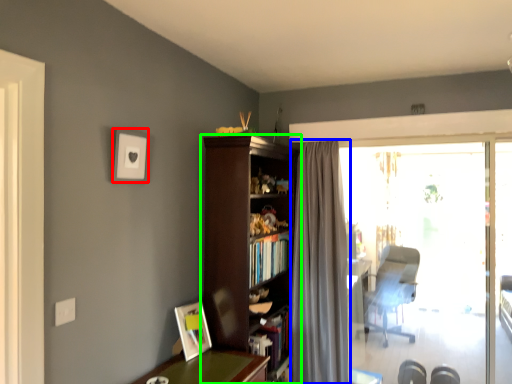
Question: Which is farther away from picture frame (highlighted by a red box)? curtain (highlighted by a blue box) or bookcase (highlighted by a green box)?

Choices:
 (A) curtain
 (B) bookcase

Answer: (A)